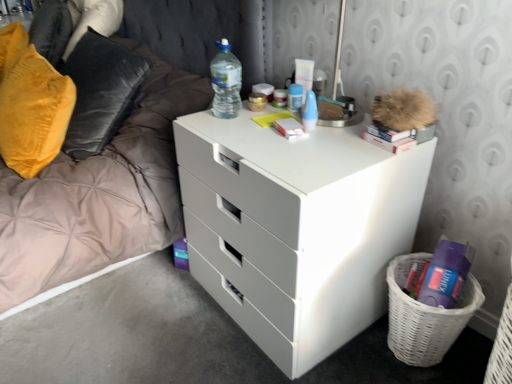
Locate an element on the screen. free area in between white matte book at center, which ranks as the second book in right-to-left order, and white plastic tube at upper center, positioned as the 1th toiletry in back-to-front order is located at coordinates (285, 117).